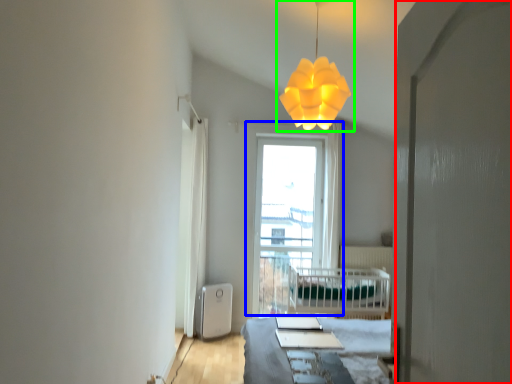
Question: Estimate the real-world distances between objects in this image. Which object is farther from screen door (highlighted by a red box), window (highlighted by a blue box) or lamp (highlighted by a green box)?

Choices:
 (A) window
 (B) lamp

Answer: (A)